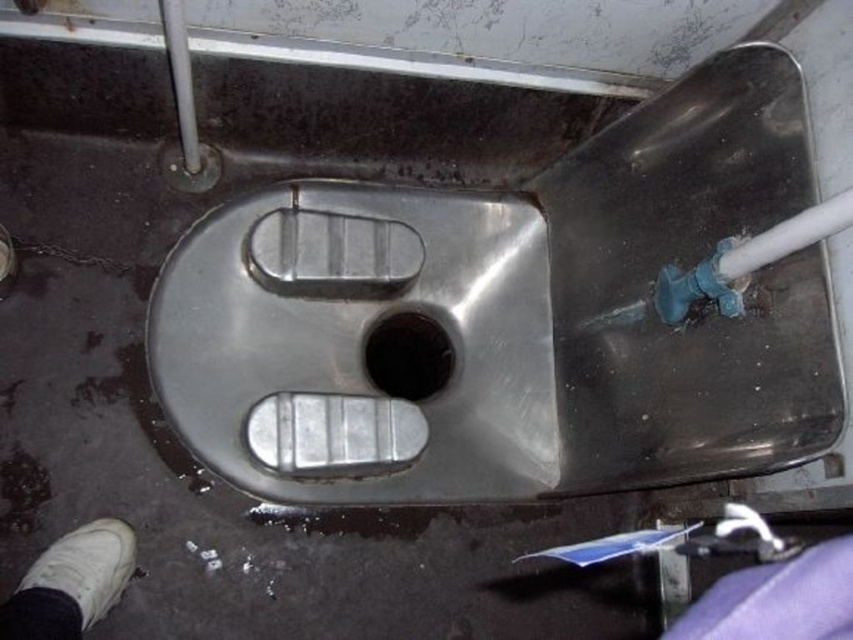
Question: Considering the real-world distances, which object is closest to the black rubber drain at center?

Choices:
 (A) white leather shoe at lower left
 (B) stainless steel sink at center

Answer: (B)

Question: Can you confirm if stainless steel sink at center is positioned above white leather shoe at lower left?

Choices:
 (A) yes
 (B) no

Answer: (A)

Question: Which point appears closest to the camera in this image?

Choices:
 (A) (244, 429)
 (B) (440, 378)
 (C) (314, 266)

Answer: (A)

Question: Does white leather shoe at lower left have a greater width compared to black rubber drain at center?

Choices:
 (A) yes
 (B) no

Answer: (B)

Question: Which point is closer to the camera taking this photo?

Choices:
 (A) (399, 342)
 (B) (468, 456)

Answer: (B)

Question: Does stainless steel sink at center have a lesser width compared to black rubber drain at center?

Choices:
 (A) yes
 (B) no

Answer: (B)